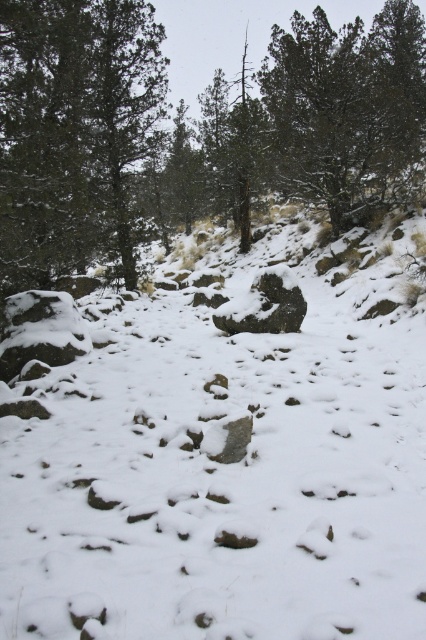
Question: Is green matte tree at upper left thinner than dark green textured tree at upper right?

Choices:
 (A) yes
 (B) no

Answer: (A)

Question: Which point is farther to the camera?

Choices:
 (A) dark green textured tree at upper right
 (B) green matte tree at upper left

Answer: (A)

Question: Which of the following is the farthest from the observer?

Choices:
 (A) (9, 465)
 (B) (48, 225)
 (C) (374, 35)
 (D) (256, 296)

Answer: (C)

Question: Where is white powdery snow at center located in relation to dark gray rock at center in the image?

Choices:
 (A) above
 (B) below

Answer: (A)

Question: Does green matte tree at upper left appear over dark gray rock at center?

Choices:
 (A) yes
 (B) no

Answer: (A)

Question: Which object appears farthest from the camera in this image?

Choices:
 (A) white powdery snow at center
 (B) green matte tree at upper left

Answer: (B)